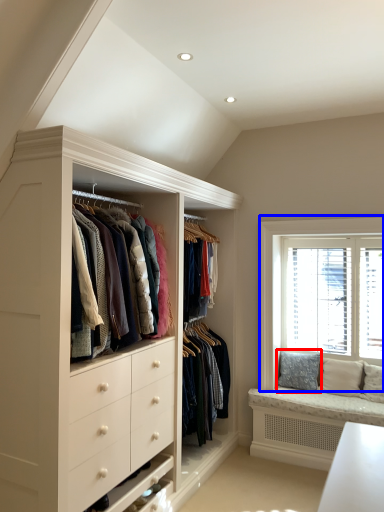
Question: Which point is further to the camera, pillow (highlighted by a red box) or window (highlighted by a blue box)?

Choices:
 (A) pillow
 (B) window

Answer: (A)